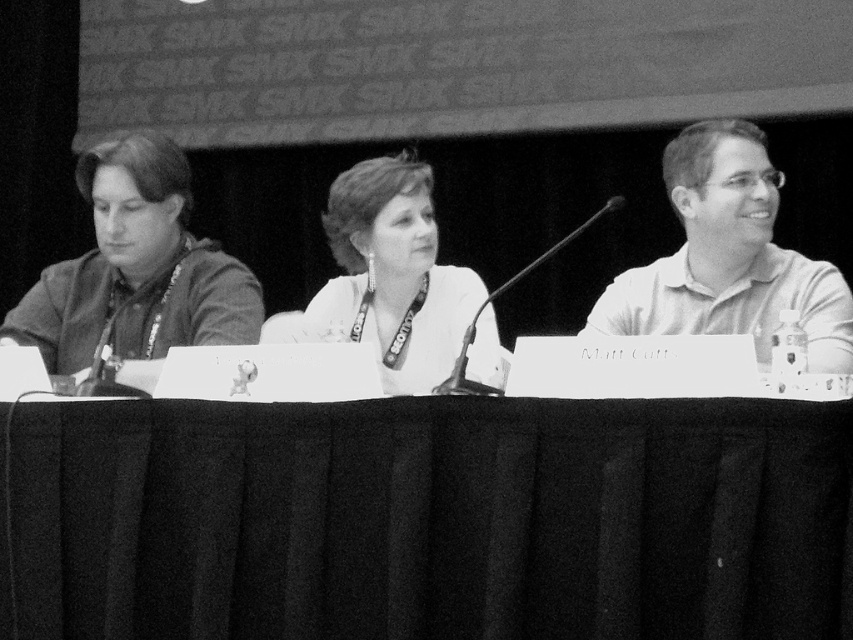
Is point (221, 324) positioned after point (379, 284)?

No.

Is matte white shirt at center bigger than white matte/soft fabric at center?

Yes, matte white shirt at center is bigger than white matte/soft fabric at center.

Is point (28, 324) positioned behind point (453, 316)?

Yes.

Image resolution: width=853 pixels, height=640 pixels. I want to click on matte white shirt at center, so click(136, 272).

Is the position of black fabric table at center less distant than that of white matte/soft fabric at center?

Yes, it is.

Which is below, black fabric table at center or white matte/soft fabric at center?

Positioned lower is black fabric table at center.

What do you see at coordinates (432, 518) in the screenshot?
I see `black fabric table at center` at bounding box center [432, 518].

Where is `black fabric table at center`? The image size is (853, 640). black fabric table at center is located at coordinates (x=432, y=518).

Between white cotton polo shirt at right and white matte/soft fabric at center, which one has less height?

white cotton polo shirt at right

Does white cotton polo shirt at right come behind white matte/soft fabric at center?

No, it is in front of white matte/soft fabric at center.

What do you see at coordinates (728, 257) in the screenshot? This screenshot has width=853, height=640. I see `white cotton polo shirt at right` at bounding box center [728, 257].

I want to click on white cotton polo shirt at right, so click(x=728, y=257).